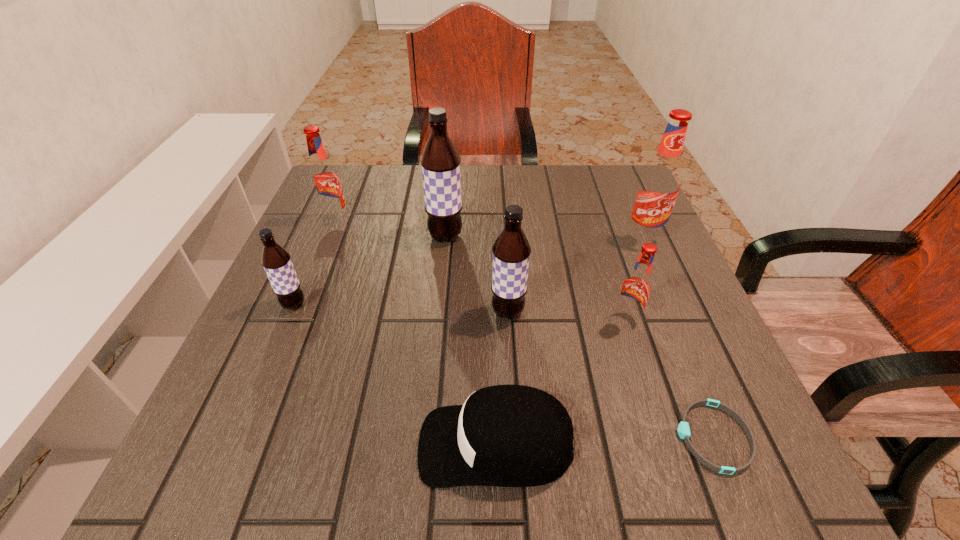
The height and width of the screenshot is (540, 960). I want to click on free space between the cap and the wristband, so click(x=605, y=441).

This screenshot has height=540, width=960. What are the coordinates of `vacant area between the smallest brown root beer and the seventh tallest object` in the screenshot? It's located at (396, 375).

Find the location of a particular element. vacant space that is in between the second smallest brown root beer and the wristband is located at coordinates (611, 374).

I want to click on blank region between the leftmost brown root beer and the gray wristband, so click(x=504, y=370).

What are the coordinates of `empty space that is in between the cap and the smallest brown root beer` in the screenshot? It's located at (396, 375).

Where is `vacant area that lies between the smallest red root beer and the farthest brown root beer`? The height and width of the screenshot is (540, 960). vacant area that lies between the smallest red root beer and the farthest brown root beer is located at coordinates coord(536,278).

The image size is (960, 540). Identify the location of vacant area between the rightmost red root beer and the seventh tallest object. (569, 341).

Image resolution: width=960 pixels, height=540 pixels. I want to click on object that is the second closest to the shortest object, so click(505, 435).

Locate an element on the screen. object that is the fourth closest to the rightmost root beer is located at coordinates (683, 429).

Locate an element on the screen. This screenshot has height=540, width=960. root beer that is the third closest to the smallest brown root beer is located at coordinates (511, 251).